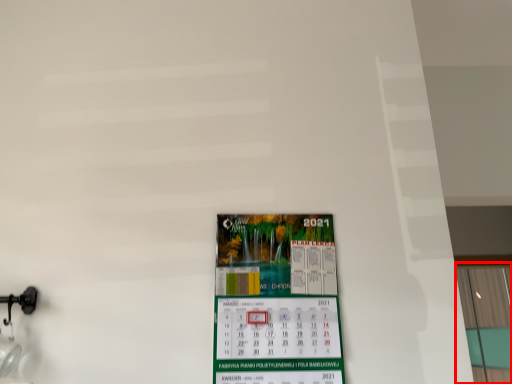
Question: From the image's perspective, what is the correct spatial relationship of window (annotated by the red box) in relation to poster?

Choices:
 (A) above
 (B) below

Answer: (B)